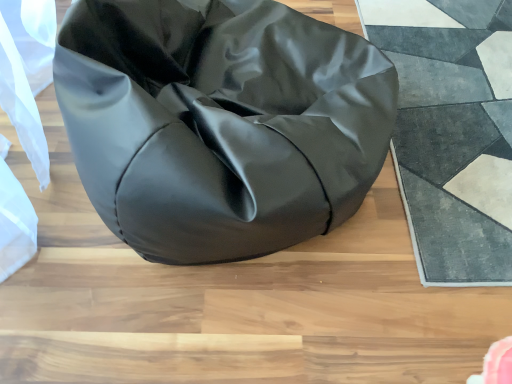
Question: Is textured gray rug at right wider or thinner than matte black bean bag at center?

Choices:
 (A) thin
 (B) wide

Answer: (A)

Question: From the image's perspective, is textured gray rug at right positioned above or below matte black bean bag at center?

Choices:
 (A) above
 (B) below

Answer: (B)

Question: Is point (464, 168) positioned closer to the camera than point (117, 168)?

Choices:
 (A) farther
 (B) closer

Answer: (A)

Question: From the image's perspective, is matte black bean bag at center positioned above or below textured gray rug at right?

Choices:
 (A) below
 (B) above

Answer: (B)

Question: In terms of height, does matte black bean bag at center look taller or shorter compared to textured gray rug at right?

Choices:
 (A) tall
 (B) short

Answer: (A)

Question: Is point (355, 175) closer or farther from the camera than point (437, 187)?

Choices:
 (A) farther
 (B) closer

Answer: (B)

Question: From a real-world perspective, is matte black bean bag at center above or below textured gray rug at right?

Choices:
 (A) below
 (B) above

Answer: (B)